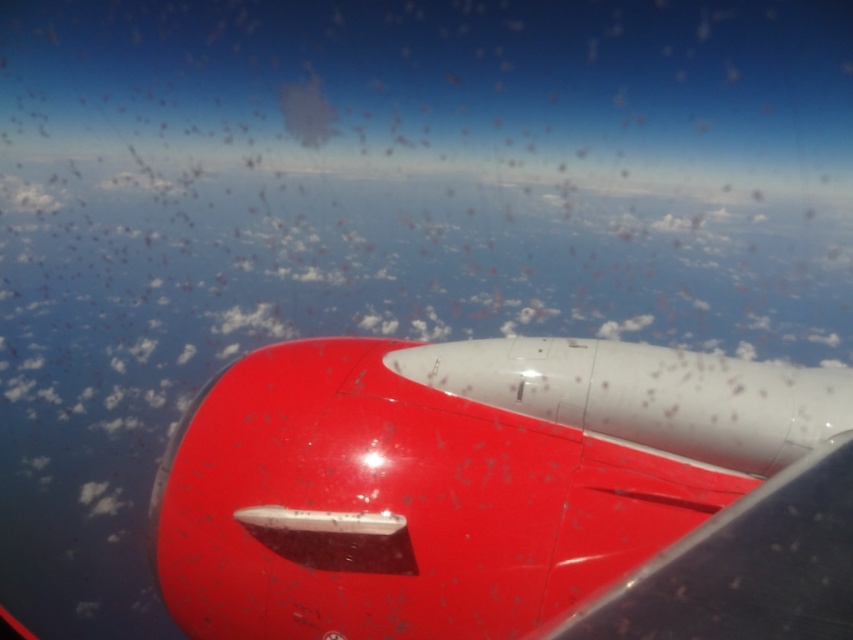
Between glossy red airplane wing at center and glossy red wing at center, which one appears on the left side from the viewer's perspective?

glossy red airplane wing at center

Which is in front, point (534, 378) or point (828, 492)?

Point (828, 492) is more forward.

Image resolution: width=853 pixels, height=640 pixels. Identify the location of glossy red airplane wing at center. (456, 477).

Find the location of a particular element. The image size is (853, 640). glossy red airplane wing at center is located at coordinates (456, 477).